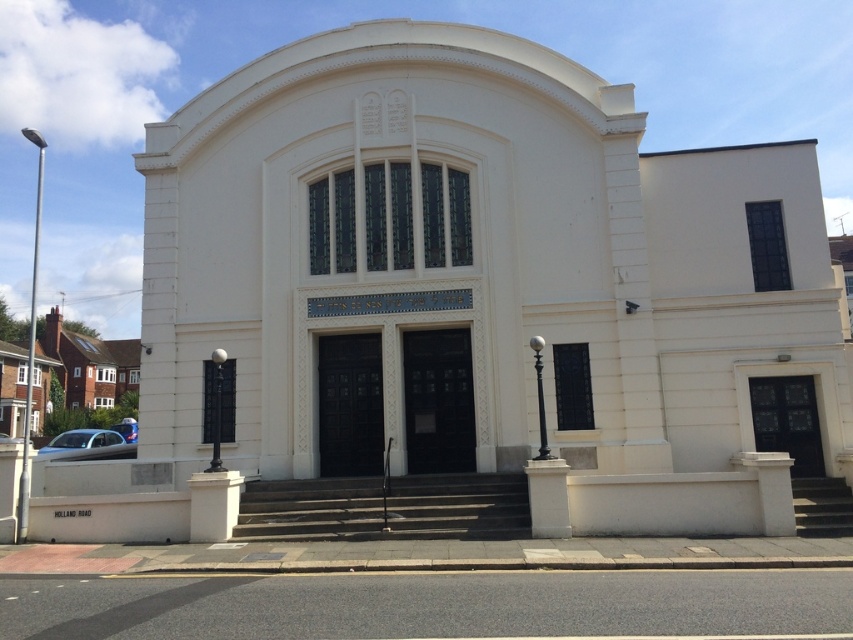
Is point (825, 496) closer to viewer compared to point (135, 426)?

Yes, it is in front of point (135, 426).

Is concrete stairs at lower right below metallic silver car at lower left?

Actually, concrete stairs at lower right is above metallic silver car at lower left.

Measure the distance between concrete stairs at lower right and camera.

The distance of concrete stairs at lower right from camera is 12.32 meters.

Locate an element on the screen. concrete stairs at lower right is located at coordinates (822, 506).

Who is more distant from viewer, (364,131) or (119,428)?

The point (119,428) is behind.

Is white smooth chapel at center shorter than metallic silver car at lower left?

No, white smooth chapel at center is not shorter than metallic silver car at lower left.

Describe the element at coordinates (479, 273) in the screenshot. The height and width of the screenshot is (640, 853). I see `white smooth chapel at center` at that location.

The image size is (853, 640). I want to click on white smooth chapel at center, so click(479, 273).

Is white smooth chapel at center positioned before concrete stairs at lower right?

Yes, white smooth chapel at center is in front of concrete stairs at lower right.

Does white smooth chapel at center have a smaller size compared to concrete stairs at lower right?

Actually, white smooth chapel at center might be larger than concrete stairs at lower right.

In the scene shown: Who is more forward, [527,172] or [842,524]?

Point [842,524]

At what (x,y) coordinates should I click in order to perform the action: click on white smooth chapel at center. Please return your answer as a coordinate pair (x, y). Looking at the image, I should click on (479, 273).